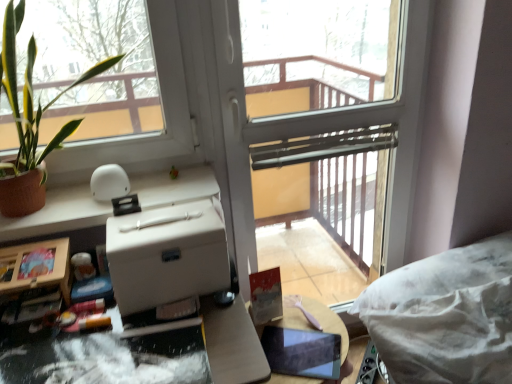
I want to click on free point above white matte counter top at upper left (from a real-world perspective), so click(x=102, y=201).